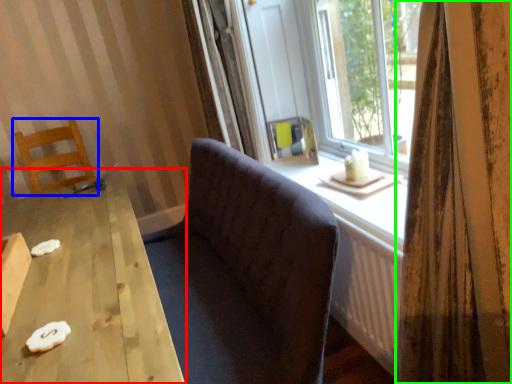
Question: Based on their relative distances, which object is nearer to table (highlighted by a red box)? Choose from chair (highlighted by a blue box) and curtain (highlighted by a green box).

Choices:
 (A) chair
 (B) curtain

Answer: (B)